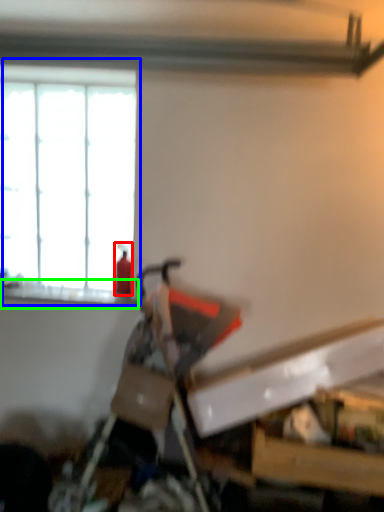
Question: Which object is positioned closest to extinguisher (highlighted by a red box)? Select from window (highlighted by a blue box) and window sill (highlighted by a green box).

Choices:
 (A) window
 (B) window sill

Answer: (B)